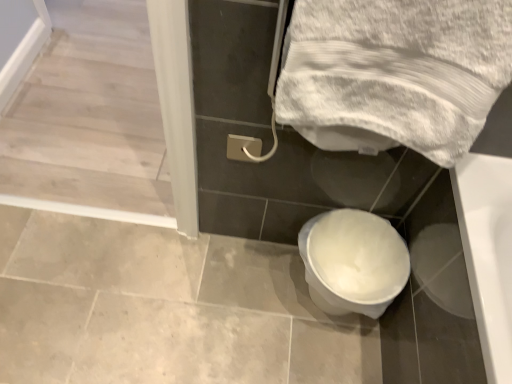
Find the location of `white textured towel at upper right`. white textured towel at upper right is located at coordinates (396, 70).

Image resolution: width=512 pixels, height=384 pixels. What do you see at coordinates (353, 262) in the screenshot? I see `white glossy toilet at lower center` at bounding box center [353, 262].

Locate an element on the screen. The image size is (512, 384). white glossy toilet at lower center is located at coordinates (353, 262).

Find the location of a particular element. white textured towel at upper right is located at coordinates (396, 70).

Considering the relative positions of white glossy screen door at upper left and white glossy toilet at lower center in the image provided, is white glossy screen door at upper left to the left of white glossy toilet at lower center from the viewer's perspective?

Indeed, white glossy screen door at upper left is positioned on the left side of white glossy toilet at lower center.

Do you think white glossy screen door at upper left is within white glossy toilet at lower center, or outside of it?

white glossy screen door at upper left lies outside white glossy toilet at lower center.

Is white glossy screen door at upper left oriented towards white glossy toilet at lower center?

No, white glossy screen door at upper left is not turned towards white glossy toilet at lower center.

Which point is more forward, (329,302) or (338,94)?

The point (338,94) is closer to the camera.

What's the angular difference between white glossy toilet at lower center and white textured towel at upper right's facing directions?

The facing directions of white glossy toilet at lower center and white textured towel at upper right are 1.82 degrees apart.

Is white glossy toilet at lower center shorter than white textured towel at upper right?

Yes, white glossy toilet at lower center is shorter than white textured towel at upper right.

Considering the sizes of white glossy toilet at lower center and white textured towel at upper right in the image, is white glossy toilet at lower center bigger or smaller than white textured towel at upper right?

Clearly, white glossy toilet at lower center is smaller in size than white textured towel at upper right.

What's the angular difference between white textured towel at upper right and white glossy screen door at upper left's facing directions?

The angle between the facing direction of white textured towel at upper right and the facing direction of white glossy screen door at upper left is 0.0487 degrees.

Is point (308, 139) positioned in front of point (183, 204)?

Yes.

Is white textured towel at upper right wider or thinner than white glossy screen door at upper left?

white textured towel at upper right is thinner than white glossy screen door at upper left.

From a real-world perspective, is white textured towel at upper right over white glossy screen door at upper left?

Indeed, from a real-world perspective, white textured towel at upper right stands above white glossy screen door at upper left.

Does point (406, 2) lie in front of point (368, 259)?

That is True.

Where is `toilet directly beneath the white textured towel at upper right (from a real-world perspective)`? The height and width of the screenshot is (384, 512). toilet directly beneath the white textured towel at upper right (from a real-world perspective) is located at coordinates (353, 262).

Would you consider white textured towel at upper right to be distant from white glossy toilet at lower center?

No, white textured towel at upper right is not far from white glossy toilet at lower center.

From a real-world perspective, is white textured towel at upper right over white glossy toilet at lower center?

Indeed, from a real-world perspective, white textured towel at upper right stands above white glossy toilet at lower center.

Does white glossy toilet at lower center have a greater width compared to white glossy screen door at upper left?

No, white glossy toilet at lower center is not wider than white glossy screen door at upper left.

From the image's perspective, is white glossy toilet at lower center positioned above or below white glossy screen door at upper left?

white glossy toilet at lower center is situated lower than white glossy screen door at upper left in the image.

In the image, is white glossy toilet at lower center on the left side or the right side of white glossy screen door at upper left?

Based on their positions, white glossy toilet at lower center is located to the right of white glossy screen door at upper left.

Which is in front, point (349, 248) or point (143, 134)?

The point (349, 248) is in front.

Considering the positions of objects white glossy screen door at upper left and white textured towel at upper right in the image provided, who is more to the left, white glossy screen door at upper left or white textured towel at upper right?

From the viewer's perspective, white glossy screen door at upper left appears more on the left side.

Which of these two, white glossy screen door at upper left or white textured towel at upper right, is bigger?

With larger size is white glossy screen door at upper left.

Is point (65, 56) behind point (400, 39)?

Yes, point (65, 56) is farther from viewer.

Measure the distance from white glossy screen door at upper left to white textured towel at upper right.

white glossy screen door at upper left and white textured towel at upper right are 27.09 inches apart.

Where is `screen door above the white glossy toilet at lower center (from the image's perspective)`? screen door above the white glossy toilet at lower center (from the image's perspective) is located at coordinates (108, 118).

Image resolution: width=512 pixels, height=384 pixels. In order to click on toilet located behind the white textured towel at upper right in this screenshot , I will do click(353, 262).

Considering their positions, is white textured towel at upper right positioned further to white glossy toilet at lower center than white glossy screen door at upper left?

The object further to white glossy toilet at lower center is white glossy screen door at upper left.

Estimate the real-world distances between objects in this image. Which object is further from white glossy screen door at upper left, white textured towel at upper right or white glossy toilet at lower center?

white glossy toilet at lower center is further to white glossy screen door at upper left.

Estimate the real-world distances between objects in this image. Which object is closer to white glossy toilet at lower center, white glossy screen door at upper left or white textured towel at upper right?

white textured towel at upper right is closer to white glossy toilet at lower center.

Which object lies further to the anchor point white textured towel at upper right, white glossy toilet at lower center or white glossy screen door at upper left?

The object further to white textured towel at upper right is white glossy screen door at upper left.

When comparing their distances from white glossy screen door at upper left, does white glossy toilet at lower center or white textured towel at upper right seem further?

white glossy toilet at lower center.

Looking at the image, which one is located further to white textured towel at upper right, white glossy screen door at upper left or white glossy toilet at lower center?

white glossy screen door at upper left is further to white textured towel at upper right.

The image size is (512, 384). Identify the location of towel situated between white glossy screen door at upper left and white glossy toilet at lower center from left to right. (396, 70).